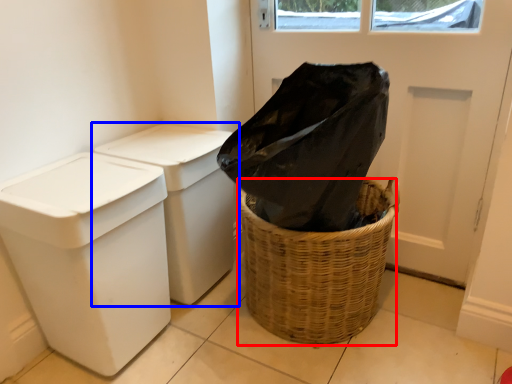
Question: Which of the following is the farthest to the observer, basket container (highlighted by a red box) or waste container (highlighted by a blue box)?

Choices:
 (A) basket container
 (B) waste container

Answer: (B)